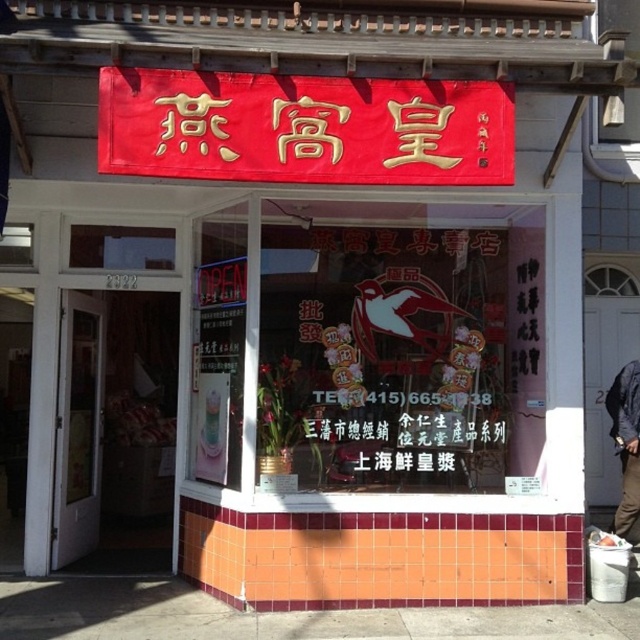
Question: Which of the following is the closest to the observer?

Choices:
 (A) pyautogui.click(x=621, y=470)
 (B) pyautogui.click(x=304, y=412)

Answer: (B)

Question: Observing the image, what is the correct spatial positioning of transparent glass window at center in reference to dark blue jacket at lower right?

Choices:
 (A) right
 (B) left

Answer: (B)

Question: Where is transparent glass window at center located in relation to dark blue jacket at lower right in the image?

Choices:
 (A) above
 (B) below

Answer: (A)

Question: Observing the image, what is the correct spatial positioning of transparent glass window at center in reference to dark blue jacket at lower right?

Choices:
 (A) right
 (B) left

Answer: (B)